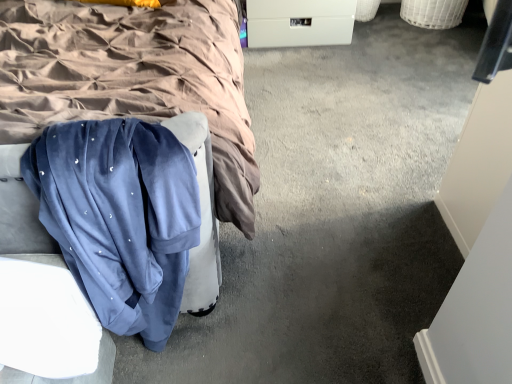
Question: From a real-world perspective, is velvet blue sweatpants at lower left over velvet blue blanket at center?

Choices:
 (A) yes
 (B) no

Answer: (B)

Question: Considering the relative sizes of velvet blue sweatpants at lower left and velvet blue blanket at center in the image provided, is velvet blue sweatpants at lower left bigger than velvet blue blanket at center?

Choices:
 (A) no
 (B) yes

Answer: (A)

Question: Does velvet blue sweatpants at lower left have a lesser width compared to velvet blue blanket at center?

Choices:
 (A) yes
 (B) no

Answer: (A)

Question: Is velvet blue blanket at center at the back of velvet blue sweatpants at lower left?

Choices:
 (A) yes
 (B) no

Answer: (A)

Question: Does velvet blue sweatpants at lower left turn towards velvet blue blanket at center?

Choices:
 (A) no
 (B) yes

Answer: (B)

Question: Is the position of velvet blue sweatpants at lower left less distant than that of velvet blue blanket at center?

Choices:
 (A) yes
 (B) no

Answer: (B)

Question: Is the position of white plastic drawer at center less distant than that of velvet blue sweatpants at lower left?

Choices:
 (A) no
 (B) yes

Answer: (A)

Question: From a real-world perspective, is white plastic drawer at center under velvet blue sweatpants at lower left?

Choices:
 (A) yes
 (B) no

Answer: (A)

Question: From the image's perspective, is white plastic drawer at center below velvet blue sweatpants at lower left?

Choices:
 (A) no
 (B) yes

Answer: (A)

Question: Can you confirm if white plastic drawer at center is thinner than velvet blue sweatpants at lower left?

Choices:
 (A) no
 (B) yes

Answer: (A)

Question: Does white plastic drawer at center have a lesser height compared to velvet blue sweatpants at lower left?

Choices:
 (A) no
 (B) yes

Answer: (B)

Question: From the image's perspective, is white plastic drawer at center on velvet blue sweatpants at lower left?

Choices:
 (A) yes
 (B) no

Answer: (A)

Question: Is there a large distance between velvet blue sweatpants at lower left and white plastic drawer at center?

Choices:
 (A) yes
 (B) no

Answer: (A)